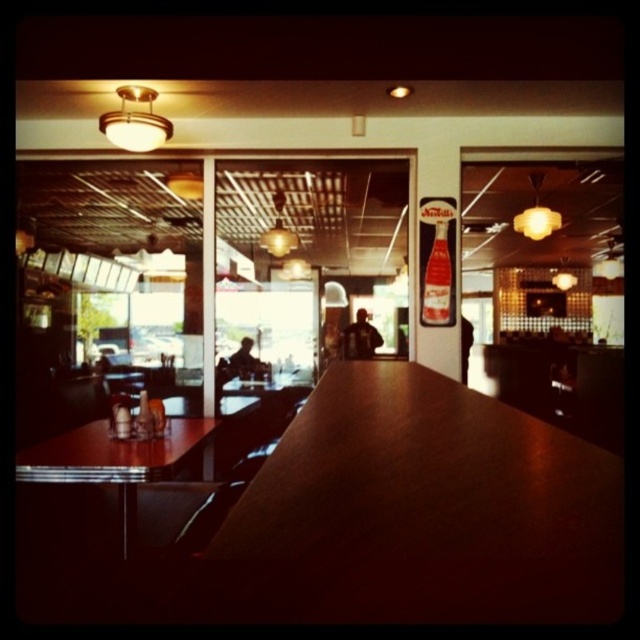
Question: Is wooden table at center wider than matte plastic bottle at center?

Choices:
 (A) yes
 (B) no

Answer: (A)

Question: Which of the following is the closest to the observer?

Choices:
 (A) (141, 420)
 (B) (125, 483)
 (C) (344, 408)

Answer: (C)

Question: Is wooden table at center to the right of matte plastic bottle at center from the viewer's perspective?

Choices:
 (A) yes
 (B) no

Answer: (A)

Question: Can you confirm if wooden table at center is positioned above translucent glass bottle at center?

Choices:
 (A) yes
 (B) no

Answer: (B)

Question: Which point is farther from the camera taking this photo?

Choices:
 (A) (140, 424)
 (B) (52, 461)

Answer: (A)

Question: Which is nearer to the wooden table at center?

Choices:
 (A) matte plastic bottle at center
 (B) wooden table at left
 (C) translucent glass bottle at center

Answer: (B)